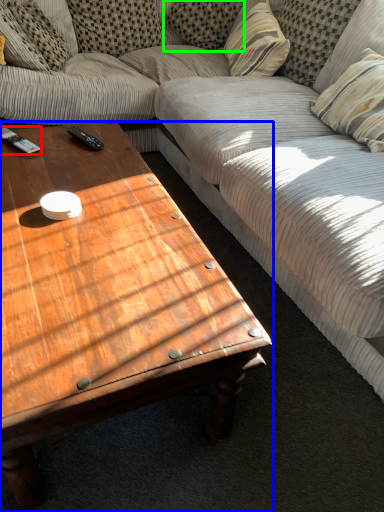
Question: Based on their relative distances, which object is farther from remote control (highlighted by a red box)? Choose from coffee table (highlighted by a blue box) and pillow (highlighted by a green box).

Choices:
 (A) coffee table
 (B) pillow

Answer: (B)